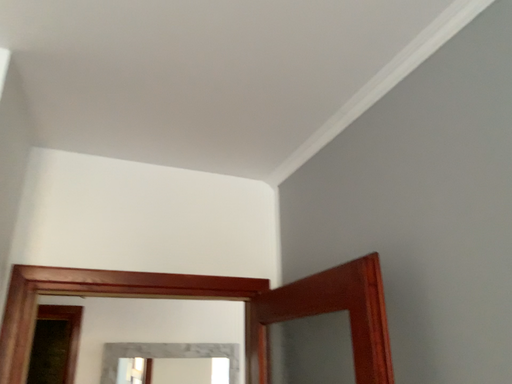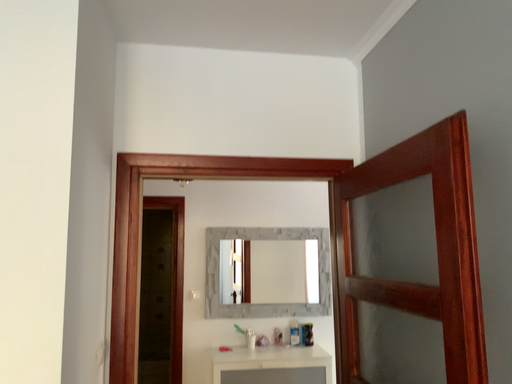
Question: Which way did the camera rotate in the video?

Choices:
 (A) rotated right
 (B) rotated left

Answer: (B)